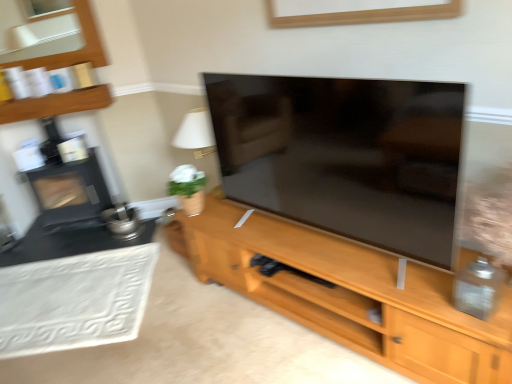
Question: Is black matte fireplace at left not close to wooden cabinet at center?

Choices:
 (A) no
 (B) yes

Answer: (B)

Question: Does black matte fireplace at left have a smaller size compared to wooden cabinet at center?

Choices:
 (A) no
 (B) yes

Answer: (B)

Question: Does black matte fireplace at left have a greater height compared to wooden cabinet at center?

Choices:
 (A) no
 (B) yes

Answer: (B)

Question: Is black matte fireplace at left shorter than wooden cabinet at center?

Choices:
 (A) no
 (B) yes

Answer: (A)

Question: Does black matte fireplace at left come in front of wooden cabinet at center?

Choices:
 (A) yes
 (B) no

Answer: (B)

Question: Considering the positions of point (39, 329) and point (102, 97), is point (39, 329) closer or farther from the camera than point (102, 97)?

Choices:
 (A) closer
 (B) farther

Answer: (A)

Question: In terms of height, does white textured rug at lower left look taller or shorter compared to wooden shelf at upper left?

Choices:
 (A) short
 (B) tall

Answer: (A)

Question: Looking at the image, does white textured rug at lower left seem bigger or smaller compared to wooden shelf at upper left?

Choices:
 (A) big
 (B) small

Answer: (A)

Question: Is white textured rug at lower left situated inside wooden shelf at upper left or outside?

Choices:
 (A) outside
 (B) inside

Answer: (A)

Question: Based on their sizes in the image, would you say black matte fireplace at left is bigger or smaller than wooden shelf at upper left?

Choices:
 (A) small
 (B) big

Answer: (B)

Question: Do you think black matte fireplace at left is within wooden shelf at upper left, or outside of it?

Choices:
 (A) inside
 (B) outside

Answer: (B)

Question: Considering their positions, is black matte fireplace at left located in front of or behind wooden shelf at upper left?

Choices:
 (A) front
 (B) behind

Answer: (B)

Question: From their relative heights in the image, would you say black matte fireplace at left is taller or shorter than wooden shelf at upper left?

Choices:
 (A) tall
 (B) short

Answer: (A)

Question: Is white textured rug at lower left taller or shorter than black matte fireplace at left?

Choices:
 (A) tall
 (B) short

Answer: (B)

Question: Considering the positions of white textured rug at lower left and black matte fireplace at left in the image, is white textured rug at lower left bigger or smaller than black matte fireplace at left?

Choices:
 (A) big
 (B) small

Answer: (B)